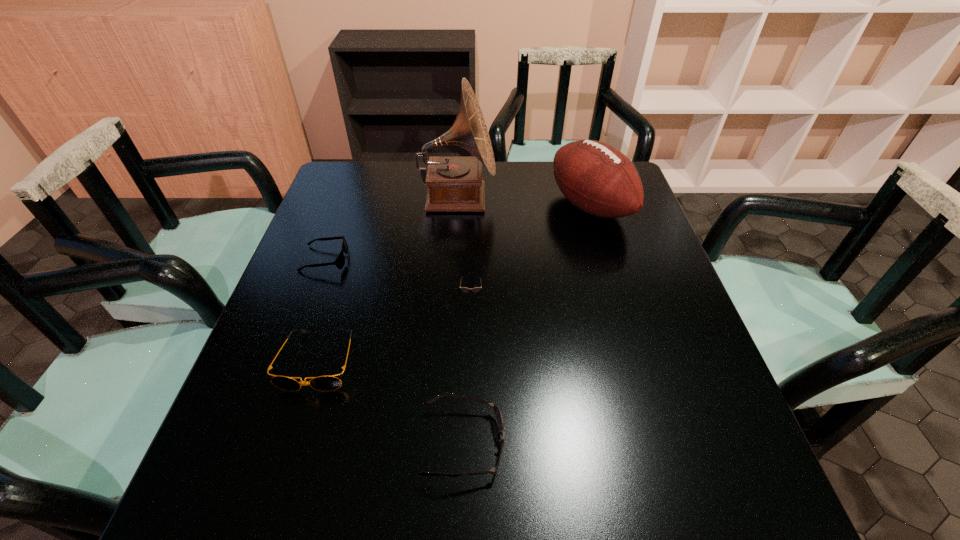
Where is `vacant area that lies between the nearest object and the second nearest sunglasses`? This screenshot has height=540, width=960. vacant area that lies between the nearest object and the second nearest sunglasses is located at coordinates (392, 402).

Image resolution: width=960 pixels, height=540 pixels. Find the location of `vacant region between the nearest sunglasses and the rightmost object`. vacant region between the nearest sunglasses and the rightmost object is located at coordinates (527, 325).

I want to click on unoccupied area between the shortest object and the second nearest object, so click(322, 310).

Where is `free point between the fifth farthest object and the rightmost object`? This screenshot has width=960, height=540. free point between the fifth farthest object and the rightmost object is located at coordinates (454, 284).

Locate which object is the second closest to the third farthest sunglasses. Please provide its 2D coordinates. Your answer should be formatted as a tuple, i.e. [(x, y)], where the tuple contains the x and y coordinates of a point satisfying the conditions above.

[(340, 260)]

I want to click on the third closest object to the football (American), so click(x=498, y=415).

Choose which sunglasses is the nearest neighbor to the nearest sunglasses. Please provide its 2D coordinates. Your answer should be formatted as a tuple, i.e. [(x, y)], where the tuple contains the x and y coordinates of a point satisfying the conditions above.

[(322, 383)]

I want to click on sunglasses identified as the third closest to the nearest sunglasses, so click(340, 260).

This screenshot has width=960, height=540. Identify the location of vacant space that satisfies the following two spatial constraints: 1. on the back side of the football (American); 2. on the horn of the phonograph record. (588, 199).

Where is `free spot that satisfies the following two spatial constraints: 1. on the horn of the second tallest object; 2. on the right side of the tallest object`? Image resolution: width=960 pixels, height=540 pixels. free spot that satisfies the following two spatial constraints: 1. on the horn of the second tallest object; 2. on the right side of the tallest object is located at coordinates (457, 206).